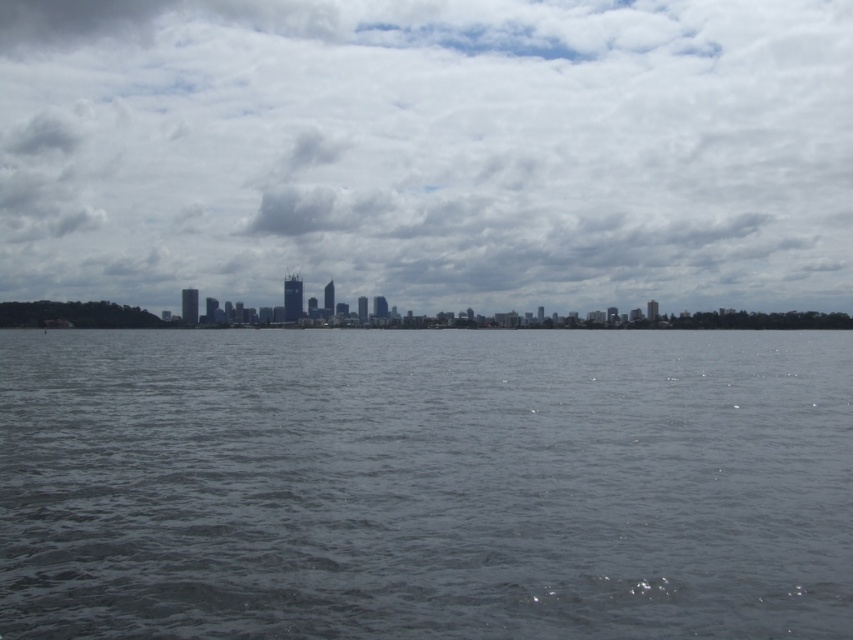
You are standing on a boat in the middle of the water and looking up. Which object is directly above you? Please choose between the gray water at center and the cloudy sky at center.

The cloudy sky at center is directly above you because the gray water at center is located below it.

You are an artist trying to paint the scene. You have a canvas divided into two equal vertical sections. You want to paint the gray water at center and the cloudy sky at center in their respective sections. Which section should you paint first to ensure proper proportions?

You should paint the cloudy sky at center first because it occupies more space in the image than the gray water at center, so you need to allocate more area to it.

You are standing on the shore looking out at the scene. Which object is closer to you, the gray water at center or the cloudy sky at center?

The gray water at center is closer to you because it is positioned in front of the cloudy sky at center.